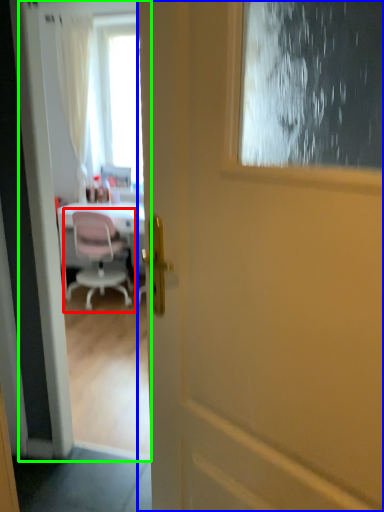
Question: Estimate the real-world distances between objects in this image. Which object is farther from chair (highlighted by a red box), door (highlighted by a blue box) or screen door (highlighted by a green box)?

Choices:
 (A) door
 (B) screen door

Answer: (A)